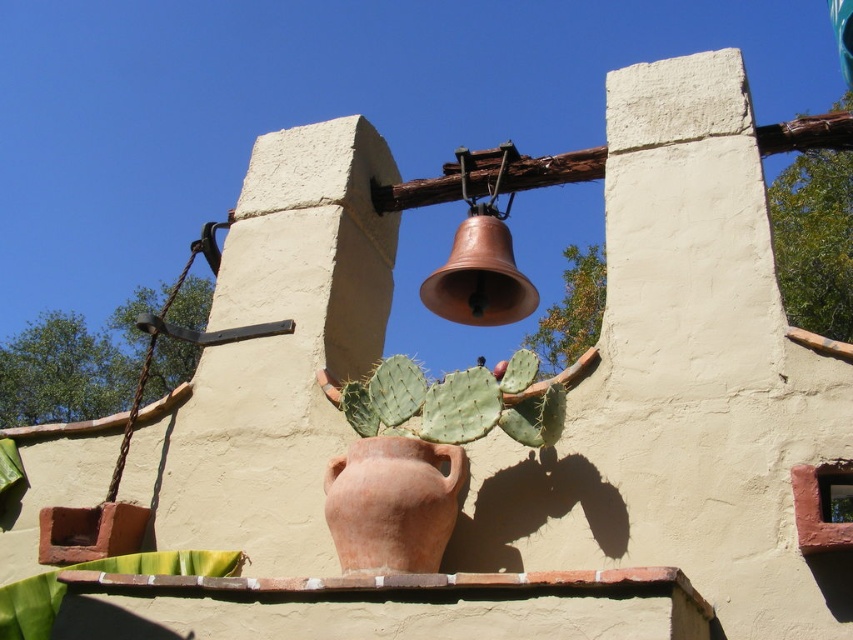
Question: Which point appears closest to the camera in this image?

Choices:
 (A) (422, 372)
 (B) (587, 260)

Answer: (A)

Question: Which object is positioned farthest from the green spiny cactus at center?

Choices:
 (A) terracotta pot at center
 (B) green spiky cactus at upper center

Answer: (B)

Question: In this image, where is green spiny cactus at center located relative to green spiky cactus at upper center?

Choices:
 (A) right
 (B) left

Answer: (B)

Question: Which point is farther to the camera?

Choices:
 (A) green spiky cactus at upper center
 (B) terracotta pot at center
 (C) green spiny cactus at center

Answer: (A)

Question: Can you confirm if green spiny cactus at center is positioned to the left of green spiky cactus at upper center?

Choices:
 (A) no
 (B) yes

Answer: (B)

Question: From the image, what is the correct spatial relationship of terracotta pot at center in relation to green spiny cactus at center?

Choices:
 (A) below
 (B) above

Answer: (A)